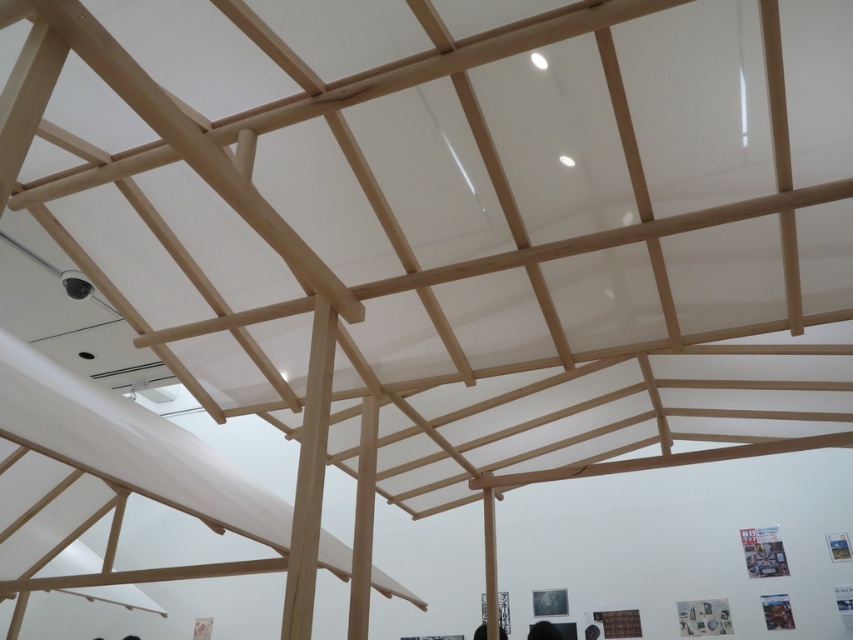
Question: Which of the following is the farthest from the observer?

Choices:
 (A) (590, 634)
 (B) (554, 632)

Answer: (A)

Question: Is black hair at lower center below dark gray fabric at lower center?

Choices:
 (A) no
 (B) yes

Answer: (A)

Question: Is black hair at lower center further to the viewer compared to dark gray fabric at lower center?

Choices:
 (A) no
 (B) yes

Answer: (A)

Question: Can you confirm if black hair at lower center is bigger than dark gray fabric at lower center?

Choices:
 (A) no
 (B) yes

Answer: (B)